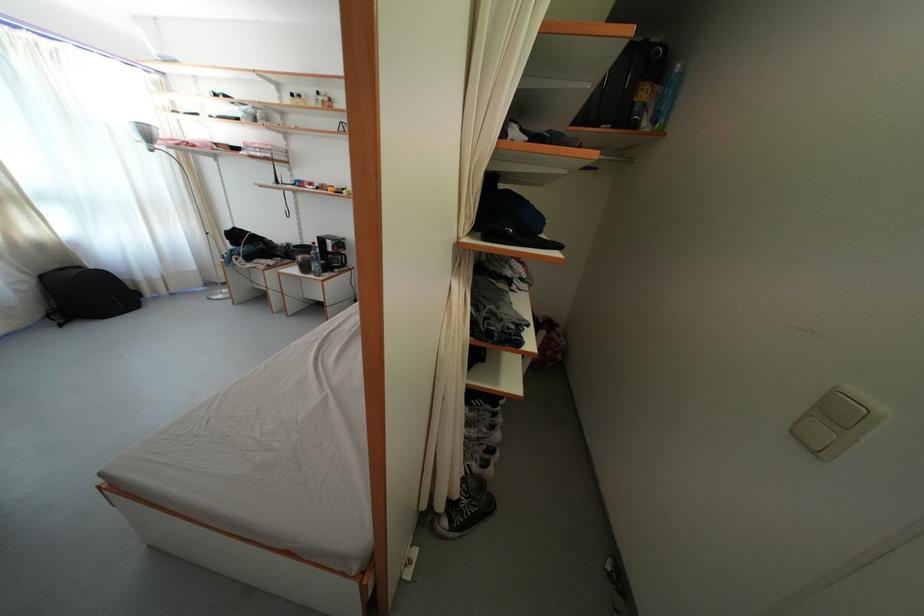
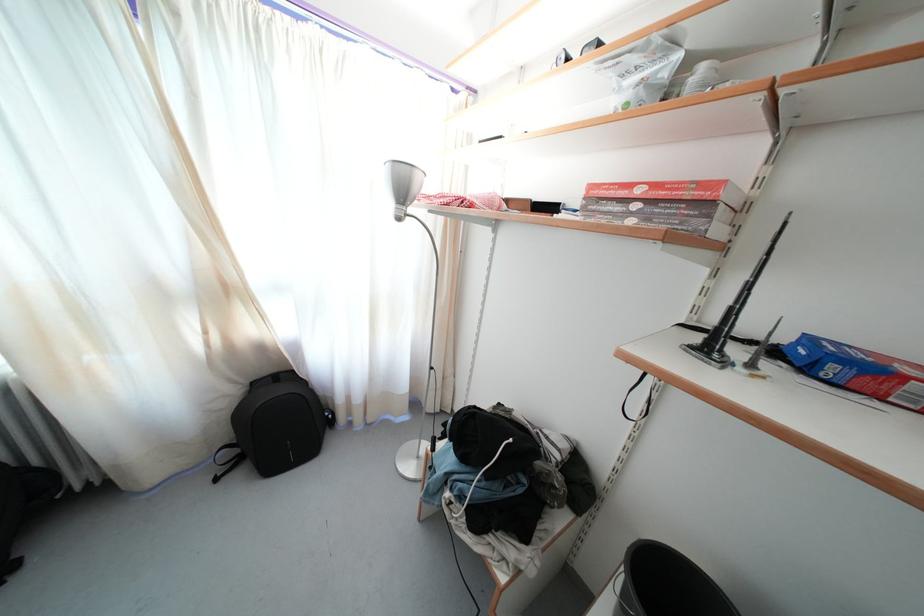
In the second image, find the point that corresponds to (x=155, y=144) in the first image.

(408, 199)